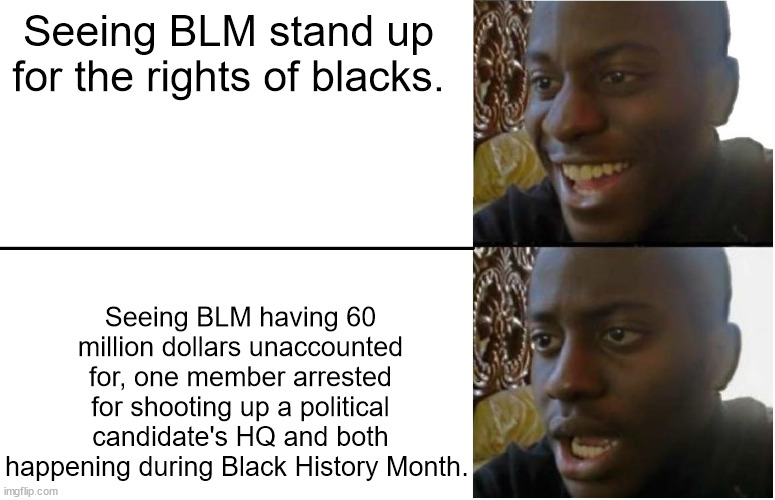
Image resolution: width=775 pixels, height=500 pixels. Find the location of `wall decoration in bottom photo`. wall decoration in bottom photo is located at coordinates (508, 338).